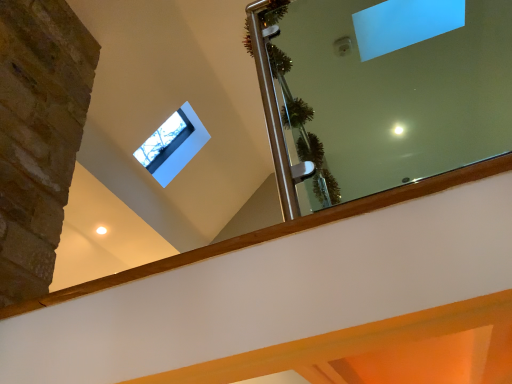
Question: From a real-world perspective, is clear glass mirror at upper center over transparent glass window at upper center?

Choices:
 (A) no
 (B) yes

Answer: (A)

Question: Is clear glass mirror at upper center smaller than transparent glass window at upper center?

Choices:
 (A) yes
 (B) no

Answer: (B)

Question: Is clear glass mirror at upper center at the right side of transparent glass window at upper center?

Choices:
 (A) yes
 (B) no

Answer: (A)

Question: Would you say clear glass mirror at upper center is outside transparent glass window at upper center?

Choices:
 (A) yes
 (B) no

Answer: (A)

Question: Considering the relative sizes of clear glass mirror at upper center and transparent glass window at upper center in the image provided, is clear glass mirror at upper center taller than transparent glass window at upper center?

Choices:
 (A) yes
 (B) no

Answer: (A)

Question: Is clear glass mirror at upper center not close to transparent glass window at upper center?

Choices:
 (A) no
 (B) yes

Answer: (B)

Question: Does transparent glass window at upper center appear on the right side of clear glass mirror at upper center?

Choices:
 (A) no
 (B) yes

Answer: (A)

Question: From the image's perspective, does transparent glass window at upper center appear lower than clear glass mirror at upper center?

Choices:
 (A) no
 (B) yes

Answer: (B)

Question: Is transparent glass window at upper center wider than clear glass mirror at upper center?

Choices:
 (A) yes
 (B) no

Answer: (B)

Question: Considering the relative positions of transparent glass window at upper center and clear glass mirror at upper center in the image provided, is transparent glass window at upper center to the left of clear glass mirror at upper center from the viewer's perspective?

Choices:
 (A) no
 (B) yes

Answer: (B)

Question: Is transparent glass window at upper center facing towards clear glass mirror at upper center?

Choices:
 (A) yes
 (B) no

Answer: (B)

Question: Is transparent glass window at upper center taller than clear glass mirror at upper center?

Choices:
 (A) no
 (B) yes

Answer: (A)

Question: From their relative heights in the image, would you say clear glass mirror at upper center is taller or shorter than transparent glass window at upper center?

Choices:
 (A) short
 (B) tall

Answer: (B)